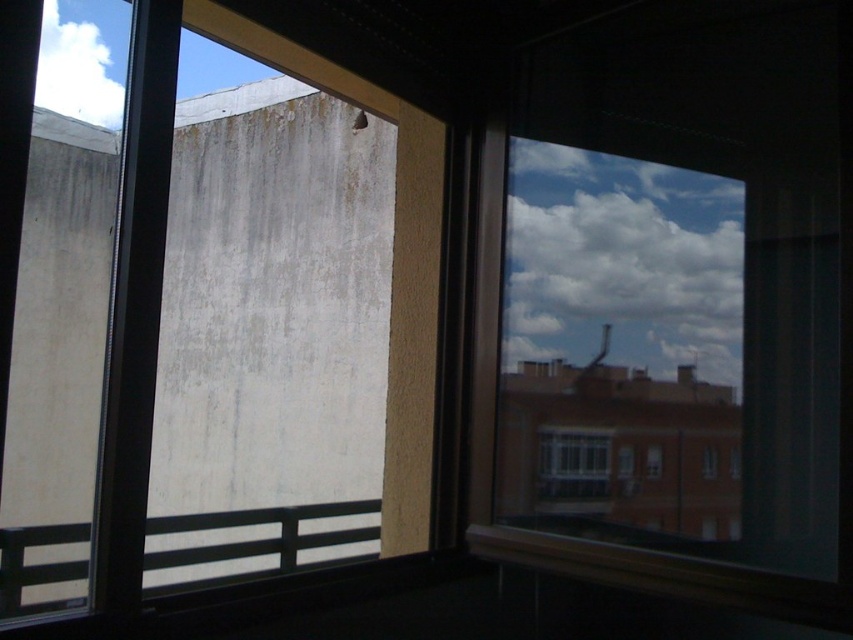
You are an interior designer assessing the natural light in a room. You notice the transparent glass window at upper right and the clear glass window at center. Which window allows more sunlight into the room based on their sizes?

The transparent glass window at upper right might be wider than clear glass window at center, so it likely allows more sunlight into the room.

You are inside a room with two windows. You need to look through the transparent glass window at upper right and the clear glass window at center to see the sky. Which window provides a better view of the sky?

The transparent glass window at upper right is located above the clear glass window at center, so it might provide a better view of the sky since it is higher up and less obstructed by the wall below.

You are an interior designer assessing the lighting in a room. You notice the transparent glass window at upper right and the clear glass window at center. Which window allows more natural light into the room?

The transparent glass window at upper right allows more natural light into the room because it is bigger than the clear glass window at center.